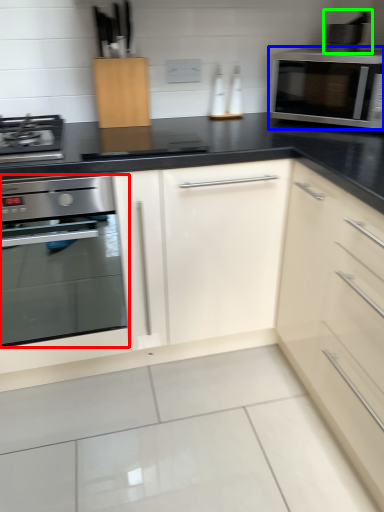
Question: Considering the real-world distances, which object is farthest from oven (highlighted by a red box)? microwave oven (highlighted by a blue box) or appliance (highlighted by a green box)?

Choices:
 (A) microwave oven
 (B) appliance

Answer: (B)